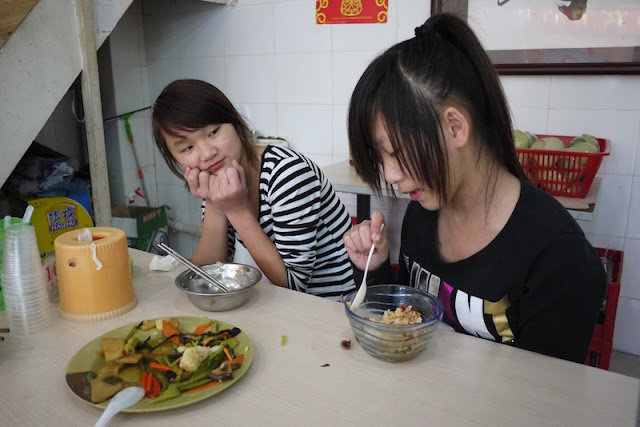
I want to click on white tiled back wall, so click(292, 90).